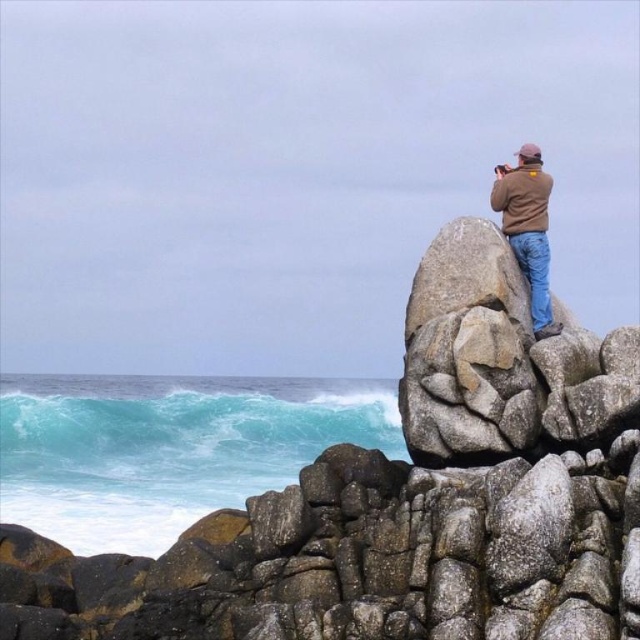
Can you confirm if granite boulder at upper right is positioned above blue denim jeans at upper right?

No.

Describe the element at coordinates (404, 500) in the screenshot. I see `granite boulder at upper right` at that location.

Find the location of a particular element. Image resolution: width=640 pixels, height=640 pixels. granite boulder at upper right is located at coordinates (404, 500).

Is granite boulder at upper right smaller than brown suede jacket at upper right?

No, granite boulder at upper right is not smaller than brown suede jacket at upper right.

Between point (490, 412) and point (547, 288), which one is positioned behind?

The point (547, 288) is behind.

Identify the location of granite boulder at upper right. This screenshot has height=640, width=640. (404, 500).

Does brown suede jacket at upper right lie behind blue denim jeans at upper right?

Yes, it is.

Can you confirm if brown suede jacket at upper right is positioned above blue denim jeans at upper right?

Correct, brown suede jacket at upper right is located above blue denim jeans at upper right.

Between point (531, 305) and point (541, 262), which one is positioned behind?

Point (541, 262)

The width and height of the screenshot is (640, 640). I want to click on brown suede jacket at upper right, so tap(528, 228).